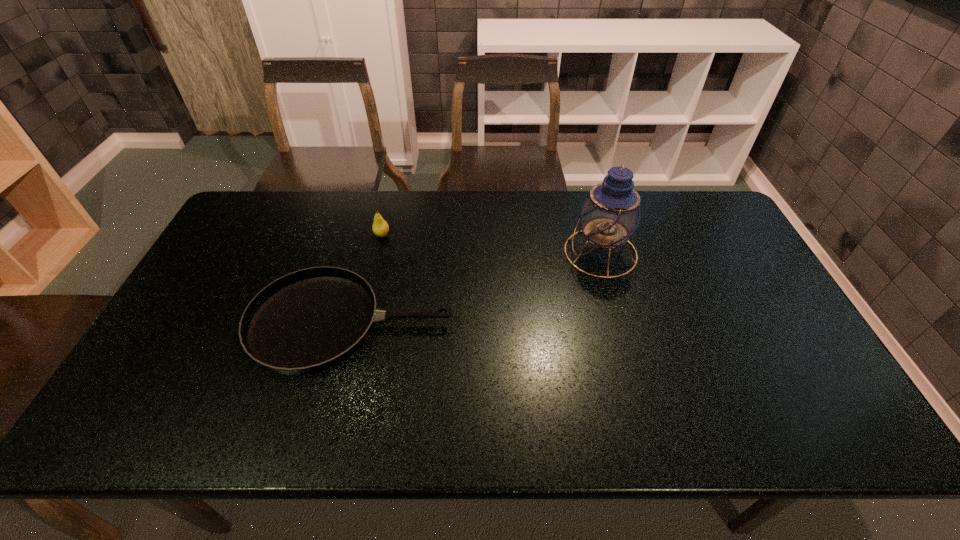
The image size is (960, 540). I want to click on lantern, so click(x=611, y=213).

Identify the location of the rightmost object. (611, 213).

Locate an element on the screen. This screenshot has height=540, width=960. the second tallest object is located at coordinates (380, 227).

You are a GUI agent. You are given a task and a screenshot of the screen. Output one action in this format:
    pyautogui.click(x=<x>, y=<y>)
    Task: Click on the frying pan
    This screenshot has height=540, width=960.
    Given the screenshot: What is the action you would take?
    pyautogui.click(x=310, y=320)

Find the location of `free space located 0.090m on the front-facing side of the lantern`. free space located 0.090m on the front-facing side of the lantern is located at coordinates (536, 253).

The height and width of the screenshot is (540, 960). I want to click on free space located 0.090m on the front-facing side of the lantern, so click(x=536, y=253).

This screenshot has height=540, width=960. Identify the location of vacant space situated on the front-facing side of the lantern. (539, 253).

In order to click on vacant region located on the left of the pear in this screenshot , I will do (x=323, y=235).

In order to click on vacant space located on the handle side of the shortest object in this screenshot , I will do `click(553, 323)`.

Where is `lantern located in the far edge section of the desktop`? The width and height of the screenshot is (960, 540). lantern located in the far edge section of the desktop is located at coordinates (611, 213).